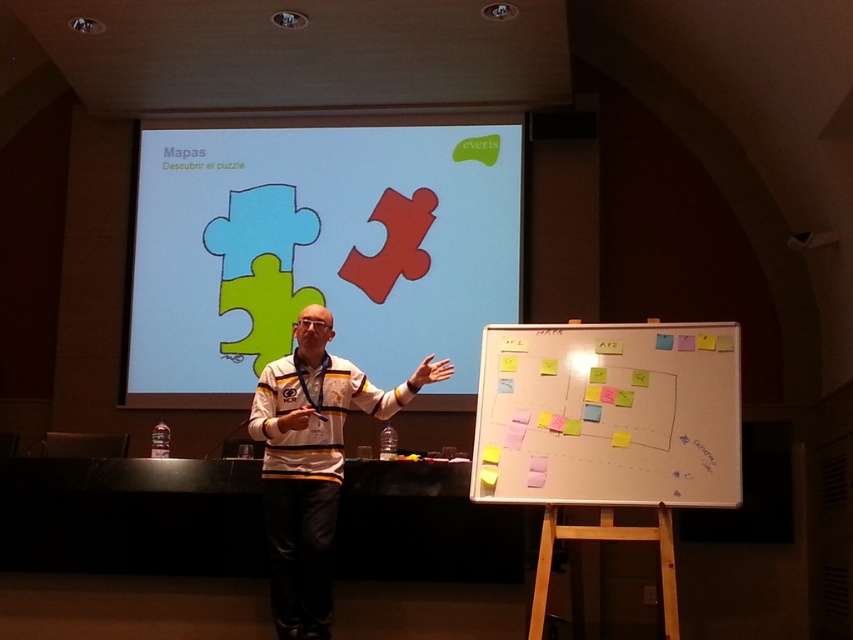
Question: Which of the following is the farthest from the observer?

Choices:
 (A) (474, 336)
 (B) (293, 554)

Answer: (A)

Question: Which of the following is the farthest from the observer?

Choices:
 (A) matte plastic puzzle pieces at center
 (B) whiteboard paper at center

Answer: (A)

Question: Is matte plastic puzzle pieces at center below whiteboard paper at center?

Choices:
 (A) no
 (B) yes

Answer: (A)

Question: Which point is farther to the camera?

Choices:
 (A) whiteboard paper at center
 (B) matte plastic puzzle pieces at center
 (C) white jersey at center

Answer: (B)

Question: Can you confirm if matte plastic puzzle pieces at center is positioned below whiteboard paper at center?

Choices:
 (A) no
 (B) yes

Answer: (A)

Question: Where is matte plastic puzzle pieces at center located in relation to white jersey at center in the image?

Choices:
 (A) below
 (B) above

Answer: (B)